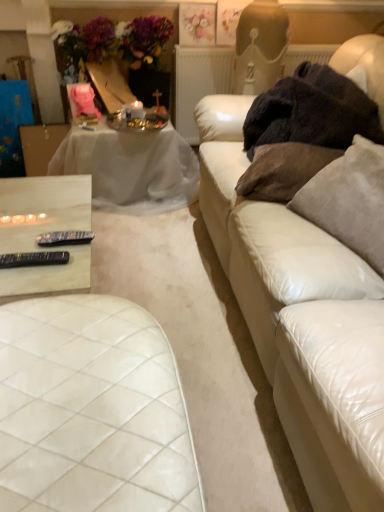
Question: From a real-world perspective, is white sheer cloth at upper left, the second table in the bottom-to-top sequence, physically located above or below brown fabric pillow at right, which ranks as the second pillow in right-to-left order?

Choices:
 (A) below
 (B) above

Answer: (A)

Question: In terms of height, does white sheer cloth at upper left, which is the first table in top-to-bottom order, look taller or shorter compared to brown fabric pillow at right, which ranks as the second pillow in right-to-left order?

Choices:
 (A) tall
 (B) short

Answer: (A)

Question: Estimate the real-world distances between objects in this image. Which object is closer to the pastel floral print at upper center?

Choices:
 (A) white marble remote controls at lower left, which is counted as the first table, starting from the front
 (B) white quilted leather ottoman at lower left
 (C) black plastic remote control at lower left, the first tableware positioned from the front
 (D) white sheer cloth at upper left, which is the first table in top-to-bottom order
 (E) dark fuzzy blanket at right

Answer: (D)

Question: Based on their relative distances, which object is farther from the black plastic remote control at lower left, which appears as the first tableware when viewed from the top?

Choices:
 (A) suede-like beige pillow at right, which is the first pillow in right-to-left order
 (B) brown fabric pillow at right, which ranks as the second pillow in right-to-left order
 (C) pastel floral print at upper center
 (D) white marble remote controls at lower left, which is counted as the first table, starting from the front
 (E) black plastic remote control at lower left, the 2th tableware in the back-to-front sequence

Answer: (C)